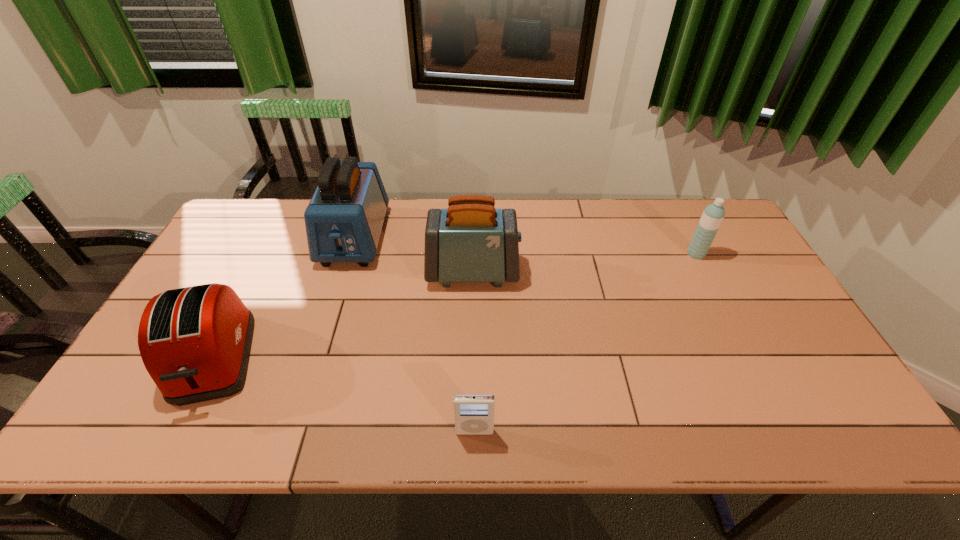
Find the location of a particular element. vacant region between the rightmost object and the fourth object from right to left is located at coordinates (x=525, y=246).

Locate an element on the screen. vacant space that's between the fourth object from right to left and the rightmost toaster is located at coordinates (414, 254).

Identify the location of vacant space that's between the leftmost toaster and the nearest object. The height and width of the screenshot is (540, 960). (345, 395).

At what (x,y) coordinates should I click in order to perform the action: click on free spot between the fourth object from right to left and the leftmost object. Please return your answer as a coordinate pair (x, y). Looking at the image, I should click on (284, 298).

Identify which object is the fourth nearest to the shortest toaster. Please provide its 2D coordinates. Your answer should be formatted as a tuple, i.e. [(x, y)], where the tuple contains the x and y coordinates of a point satisfying the conditions above.

[(713, 215)]

I want to click on the second closest object relative to the water bottle, so click(474, 413).

Identify the location of toaster that can be found as the third closest to the iPod. (344, 219).

Where is `toaster that is the closest to the nearest toaster`? Image resolution: width=960 pixels, height=540 pixels. toaster that is the closest to the nearest toaster is located at coordinates (344, 219).

The height and width of the screenshot is (540, 960). Identify the location of vacant space that satisfies the following two spatial constraints: 1. on the front-facing side of the rightmost object; 2. on the left side of the second object from left to right. (349, 254).

Find the location of `vacant area in the image that satisfies the following two spatial constraints: 1. on the front-facing side of the second toaster from left to right; 2. on the right side of the water bottle`. vacant area in the image that satisfies the following two spatial constraints: 1. on the front-facing side of the second toaster from left to right; 2. on the right side of the water bottle is located at coordinates tap(349, 254).